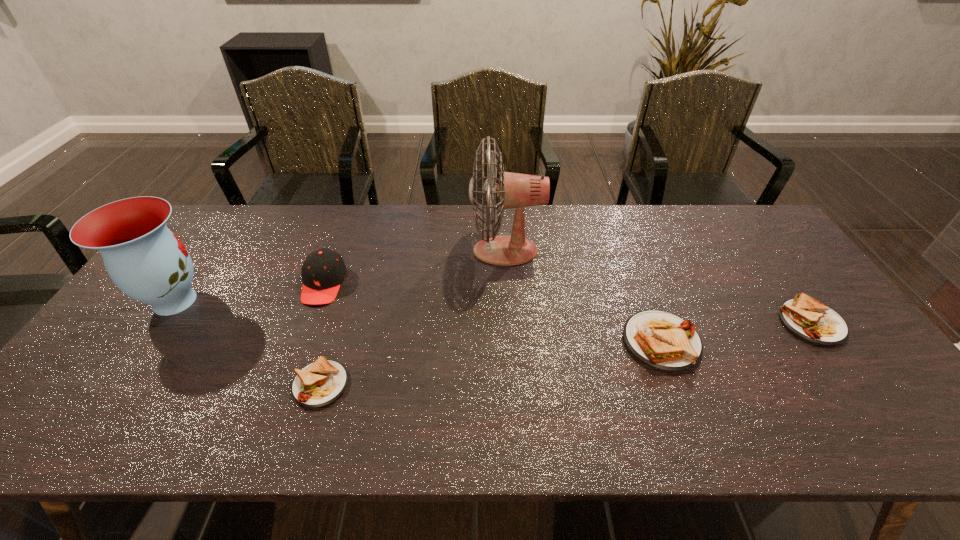
The width and height of the screenshot is (960, 540). In order to click on the shortest sandwich in this screenshot , I will do [x=320, y=383].

The image size is (960, 540). What are the coordinates of `the shortest object` in the screenshot? It's located at (320, 383).

Where is `the second sandwich from left to right`? The width and height of the screenshot is (960, 540). the second sandwich from left to right is located at coordinates (661, 340).

Where is `the tallest sandwich`? the tallest sandwich is located at coordinates (661, 340).

Where is `the second tallest sandwich`? The width and height of the screenshot is (960, 540). the second tallest sandwich is located at coordinates 807,318.

At what (x,y) coordinates should I click in order to perform the action: click on the second shortest object. Please return your answer as a coordinate pair (x, y). This screenshot has width=960, height=540. Looking at the image, I should click on (807, 318).

Where is `vase`? Image resolution: width=960 pixels, height=540 pixels. vase is located at coordinates (146, 261).

Locate an element on the screen. the leftmost object is located at coordinates (146, 261).

At what (x,y) coordinates should I click in order to perform the action: click on the tallest object. Please return your answer as a coordinate pair (x, y). This screenshot has width=960, height=540. Looking at the image, I should click on (513, 190).

Where is `fan`? This screenshot has height=540, width=960. fan is located at coordinates (513, 190).